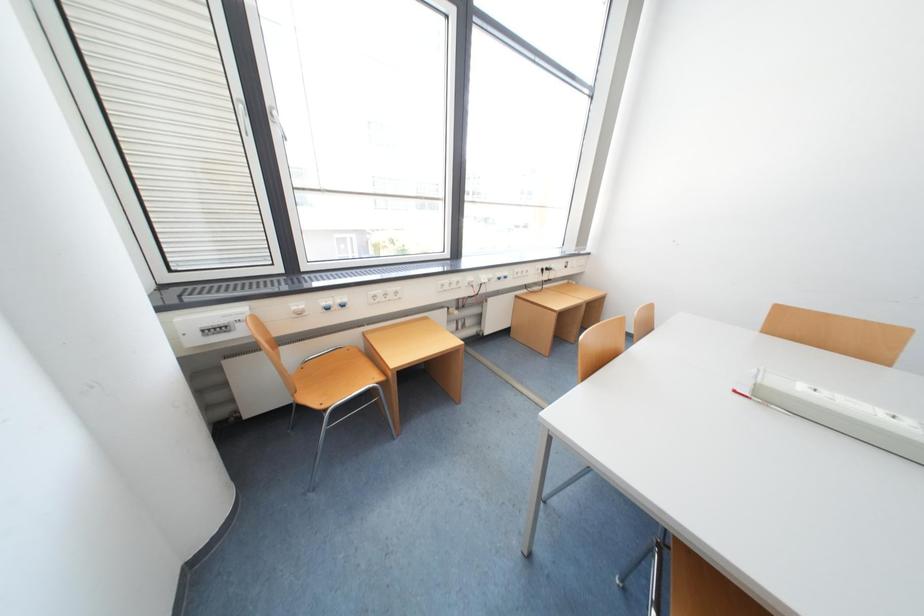
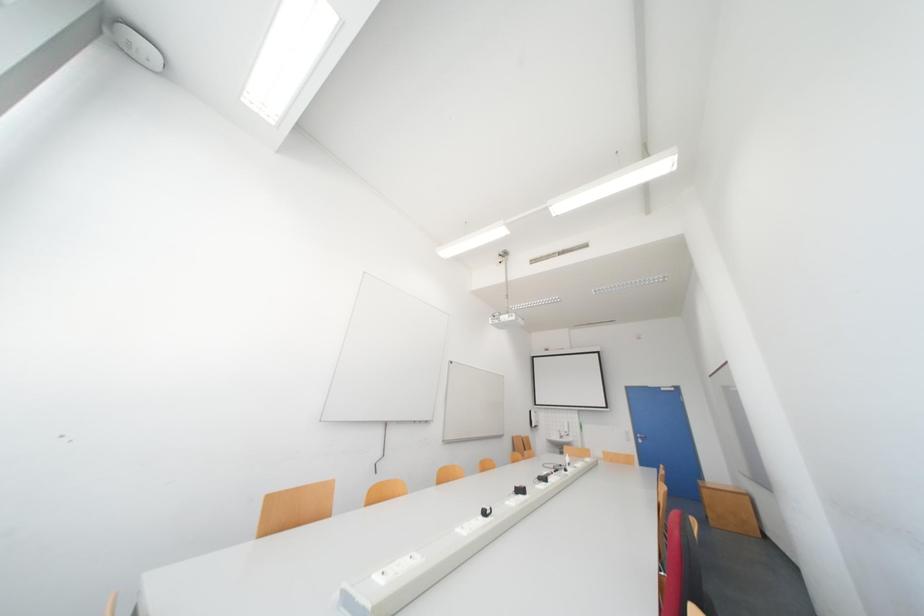
Question: The camera is either moving clockwise (left) or counter-clockwise (right) around the object. The first image is from the beginning of the video and the second image is from the end. Is the camera moving left or right when shooting the video?

Choices:
 (A) Left
 (B) Right

Answer: (A)